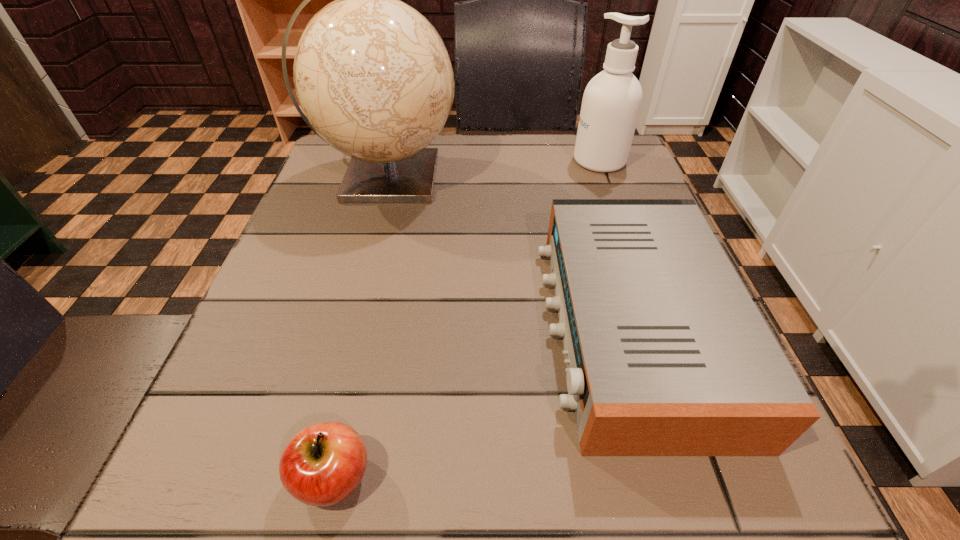
Find the location of `vacant space that's between the apple and the second tallest object`. vacant space that's between the apple and the second tallest object is located at coordinates tap(467, 319).

I want to click on vacant area that lies between the tallest object and the radio receiver, so click(509, 253).

What are the coordinates of `vacant region between the cleansing agent and the apple` in the screenshot? It's located at (467, 319).

I want to click on free space between the tallest object and the third shortest object, so click(492, 169).

In order to click on free space that is in between the globe and the radio receiver in this screenshot , I will do `click(509, 253)`.

This screenshot has width=960, height=540. What are the coordinates of `unoccupied position between the tallest object and the third shortest object` in the screenshot? It's located at (492, 169).

Locate an element on the screen. object that is the third closest to the radio receiver is located at coordinates (612, 100).

Find the location of a particular element. the closest object to the apple is located at coordinates (667, 355).

You are a GUI agent. You are given a task and a screenshot of the screen. Output one action in this format:
    pyautogui.click(x=<x>, y=<y>)
    Task: Click on the vacant space that satisfies the following two spatial constraints: 1. on the front label of the cleansing agent; 2. on the front side of the apple
    
    Given the screenshot: What is the action you would take?
    pyautogui.click(x=715, y=477)

At what (x,y) coordinates should I click in order to perform the action: click on free point that satisfies the following two spatial constraints: 1. on the surface of the tallest object showing Europe and Africa; 2. on the left side of the apple. Please return your answer as a coordinate pair (x, y). Image resolution: width=960 pixels, height=540 pixels. Looking at the image, I should click on (304, 477).